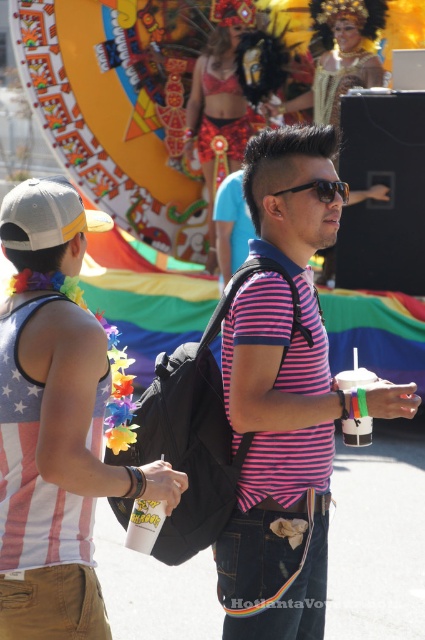
You are a photographer at the festival and want to capture both the shiny red bikini at upper center and the sunglasses at center in a single frame. Since you want to emphasize the size difference between them, which object should you position closer to the camera?

To emphasize the size difference between the shiny red bikini at upper center and the sunglasses at center, you should position the shiny red bikini at upper center closer to the camera because it has a larger size compared to the sunglasses at center.

You are at a festival and want to find a friend wearing a pink striped polo shirt at center. According to the image, where exactly should you look?

You should look at point [285,394] to find the pink striped polo shirt at center.

You are standing at the festival and want to reach a specific point marked as point (260, 394). Given that you can walk 1.2 meters per second, how long will it take you to reach that point?

The distance between you and point (260, 394) is 6.98 meters. At a walking speed of 1.2 meters per second, it will take approximately 5.82 seconds to reach the point.